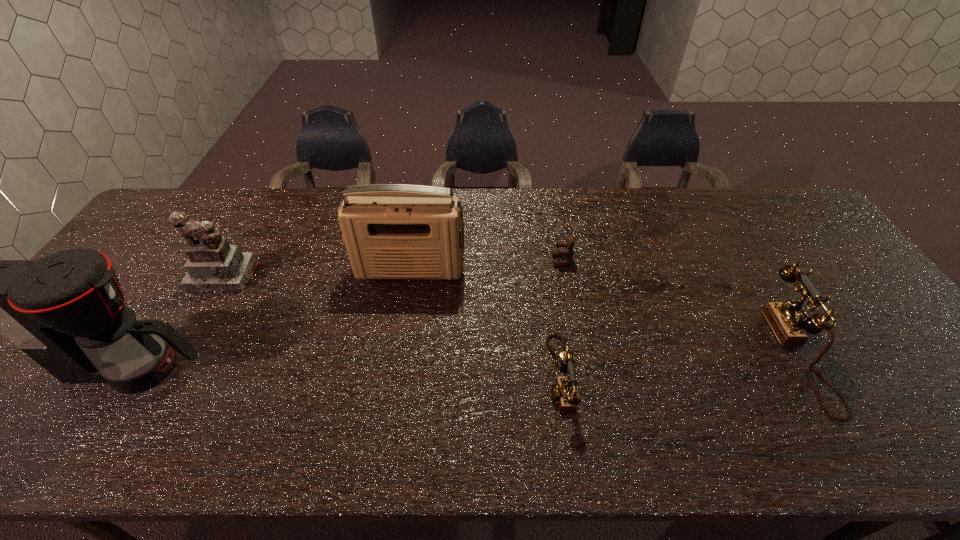
Find the location of a particular element. object that is at the left edge is located at coordinates (x=66, y=311).

You are a GUI agent. You are given a task and a screenshot of the screen. Output one action in this format:
    pyautogui.click(x=<x>, y=<y>)
    Task: Click on the object positioned at the near left corner
    The width and height of the screenshot is (960, 540).
    Given the screenshot: What is the action you would take?
    pyautogui.click(x=66, y=311)

In the image, there is a desktop. Where is `vacant space at the far edge`? The width and height of the screenshot is (960, 540). vacant space at the far edge is located at coordinates (600, 210).

This screenshot has width=960, height=540. What are the coordinates of `vacant space at the near edge of the desktop` in the screenshot? It's located at (514, 403).

In the image, there is a desktop. Identify the location of vacant area at the right edge. Image resolution: width=960 pixels, height=540 pixels. (868, 358).

At what (x,y) coordinates should I click in order to perform the action: click on unoccupied area between the left telephone and the fifth object from left to right. Please return your answer as a coordinate pair (x, y). This screenshot has width=960, height=540. Looking at the image, I should click on (561, 318).

Identify the location of blank region between the coffee maker and the radio receiver. The image size is (960, 540). (274, 319).

Where is `vacant space that's between the figurine and the coffee maker`? Image resolution: width=960 pixels, height=540 pixels. vacant space that's between the figurine and the coffee maker is located at coordinates (180, 321).

I want to click on vacant area between the shortest object and the left telephone, so click(x=561, y=318).

Identify the location of unoccupied area between the third tallest object and the shorter telephone. (392, 326).